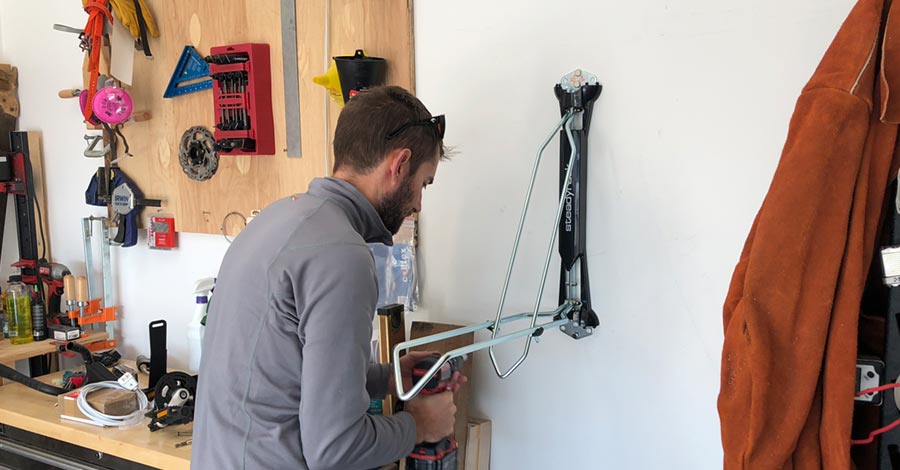
What are the coordinates of `coat` in the screenshot? It's located at (804, 228).